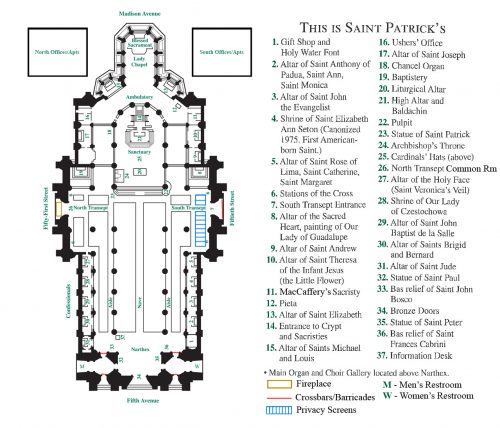
Where is `entrances`? This screenshot has height=428, width=500. entrances is located at coordinates (61, 205).